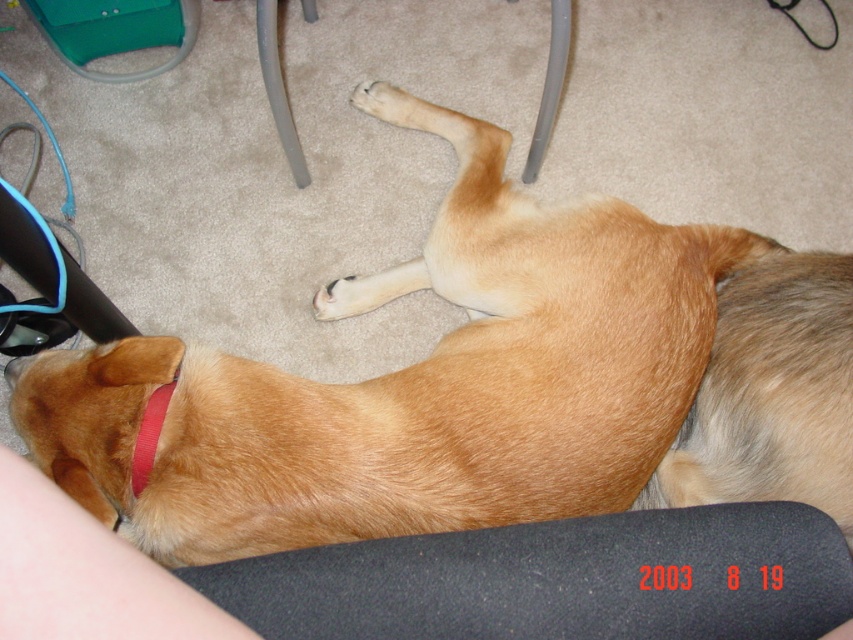
Can you confirm if fuzzy fur at center is wider than red fabric neckband at lower left?

Yes.

Is fuzzy fur at center bigger than red fabric neckband at lower left?

Yes, fuzzy fur at center is bigger than red fabric neckband at lower left.

Locate an element on the screen. This screenshot has height=640, width=853. fuzzy fur at center is located at coordinates (770, 394).

Does point (364, 305) come behind point (148, 472)?

Yes.

Which is below, golden fur dog at lower center or red fabric neckband at lower left?

red fabric neckband at lower left

Is point (231, 497) positioned in front of point (132, 465)?

That is False.

Where is `golden fur dog at lower center`? Image resolution: width=853 pixels, height=640 pixels. golden fur dog at lower center is located at coordinates (410, 381).

Locate an element on the screen. golden fur dog at lower center is located at coordinates (410, 381).

Does golden fur dog at lower center appear under black matte mouse pad at lower center?

No, golden fur dog at lower center is not below black matte mouse pad at lower center.

Who is more forward, (350, 292) or (820, 627)?

Point (820, 627) is more forward.

Where is `golden fur dog at lower center`? Image resolution: width=853 pixels, height=640 pixels. golden fur dog at lower center is located at coordinates (410, 381).